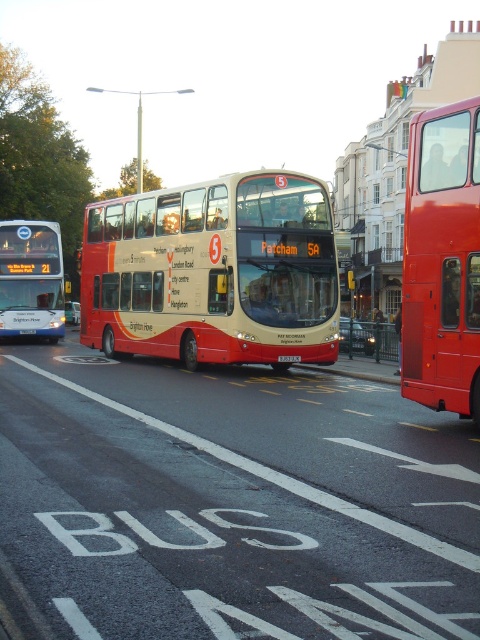
You are a passenger on the beige matte bus at center. You want to get off at the next stop. The driver tells you that the next stop is located at point (214, 273). Is this stop before or after the current location?

The point (214, 273) is on the beige matte bus at center, so the next stop is at the current location. You can get off here.

Consider the image. You are standing on the sidewalk and see two points marked on the central bus. The first point is at coordinates point (316, 209) and the second point is at point (409, 250). Which point is closer to you?

Point (316, 209) is closer to you because it is further to the viewer than point (409, 250).

In the scene shown: You are a pedestrian standing on the sidewalk and see both the matte white bus at left and the black plastic license plate at center. Which object is closer to you?

The matte white bus at left is closer to you because the black plastic license plate at center is behind it, meaning the bus is in front.